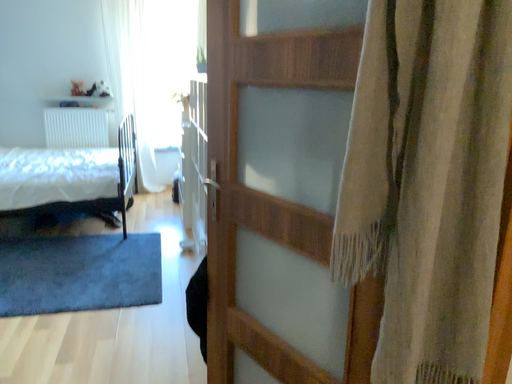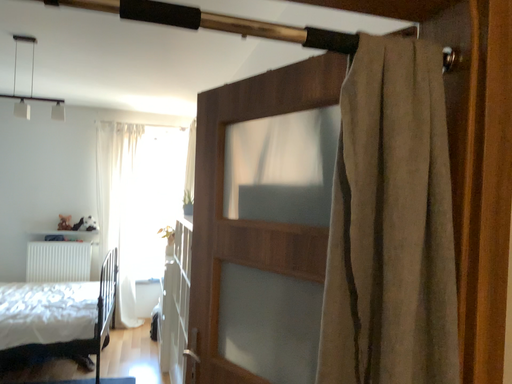
Question: How did the camera likely rotate when shooting the video?

Choices:
 (A) rotated downward
 (B) rotated upward

Answer: (B)